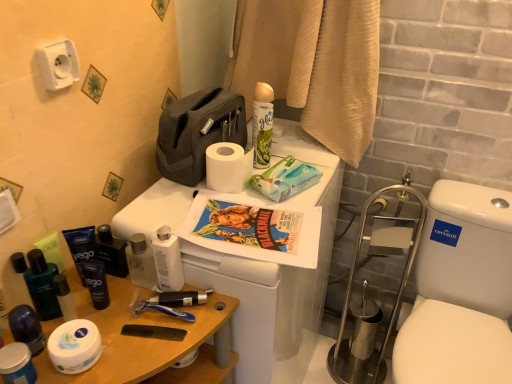
The width and height of the screenshot is (512, 384). Find the location of `free point in front of white matte toilet paper at center, the 2th toilet paper in the bottom-to-top sequence`. free point in front of white matte toilet paper at center, the 2th toilet paper in the bottom-to-top sequence is located at coordinates (256, 241).